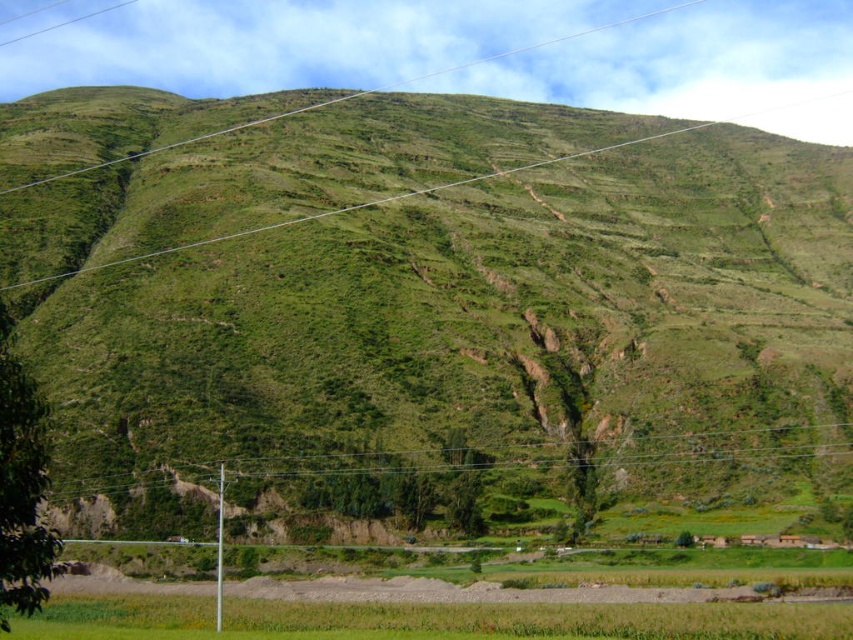
From the picture: Is the position of green grassy hillside at center more distant than that of green grassy rice field at lower center?

Yes, green grassy hillside at center is further from the viewer.

Is point (537, 316) positioned in front of point (115, 636)?

No.

Between point (624, 424) and point (86, 609), which one is positioned behind?

The point (624, 424) is behind.

The height and width of the screenshot is (640, 853). I want to click on green grassy hillside at center, so click(438, 292).

Can you confirm if green grassy rice field at lower center is shorter than green wire at center?

Yes, green grassy rice field at lower center is shorter than green wire at center.

This screenshot has width=853, height=640. I want to click on green grassy rice field at lower center, so click(x=427, y=620).

Does point (7, 141) lie behind point (741, 444)?

Yes, point (7, 141) is farther from viewer.

Is point (592, 310) less distant than point (306, 468)?

No.

At what (x,y) coordinates should I click in order to perform the action: click on green grassy hillside at center. Please return your answer as a coordinate pair (x, y). The image size is (853, 640). Looking at the image, I should click on (438, 292).